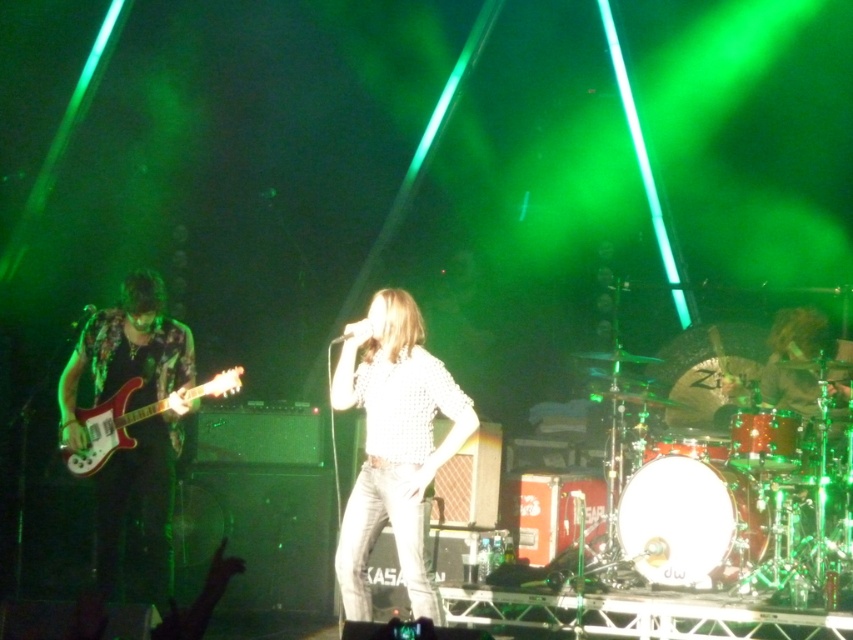
You are a photographer at the back of the venue and want to capture a photo of both the shiny metallic guitar at left and the shiny gold drum set at right in the same frame. Based on their positions, which object should you focus on first to ensure both are in the frame?

The shiny metallic guitar at left is positioned on the left side of the shiny gold drum set at right, so you should focus on the shiny gold drum set at right first to ensure both are in the frame.

You are a photographer at the back of the venue and want to capture both the white textured shirt at center and the shiny metallic guitar at left in your shot. Which object will appear smaller in your photo?

The white textured shirt at center is shorter than the shiny metallic guitar at left, so it will appear smaller in the photo.

You are a photographer at the back of the venue. You want to take a photo of the shiny gold drum set at right and the white textured shirt at center. Which one should you zoom in on first to ensure they are both in frame?

The white textured shirt at center is to the left of the shiny gold drum set at right, so you should zoom in on the shiny gold drum set at right first to ensure both are in frame.